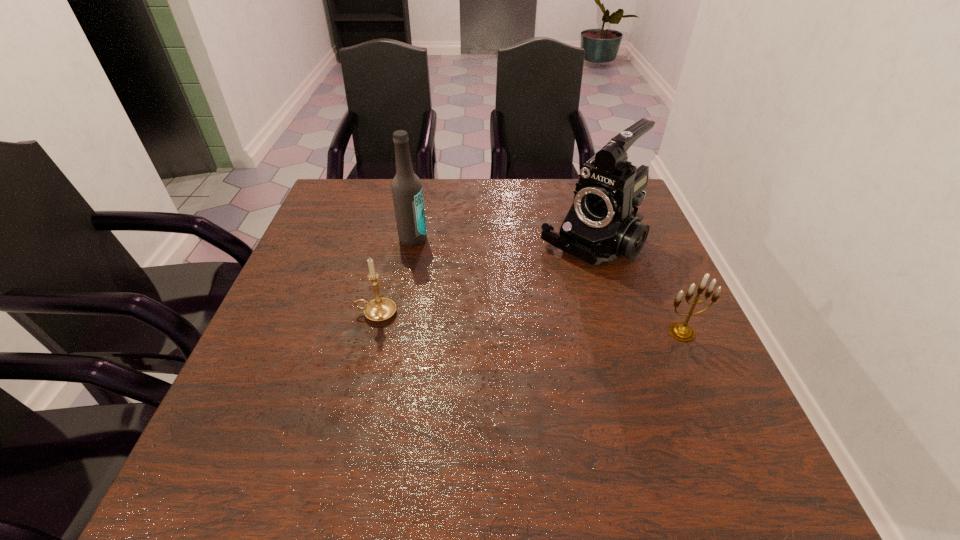
This screenshot has width=960, height=540. Identify the location of the left candelabrum. (380, 309).

Where is `the right candelabrum`? The image size is (960, 540). the right candelabrum is located at coordinates (683, 332).

Image resolution: width=960 pixels, height=540 pixels. I want to click on camcorder, so click(x=600, y=226).

Identify the location of beer bottle. Image resolution: width=960 pixels, height=540 pixels. (407, 193).

Identify the location of vacant area situated on the handle side of the left candelabrum. (284, 313).

In order to click on free point located on the handle side of the left candelabrum in this screenshot , I will do `click(311, 313)`.

I want to click on vacant space positioned 0.120m on the handle side of the left candelabrum, so click(302, 313).

The image size is (960, 540). I want to click on vacant space located 0.080m on the front of the right candelabrum, so click(701, 374).

The height and width of the screenshot is (540, 960). What are the coordinates of `free space located on the lens mount of the camcorder` in the screenshot? It's located at (524, 296).

The image size is (960, 540). I want to click on blank area located 0.350m on the lens mount of the camcorder, so click(467, 347).